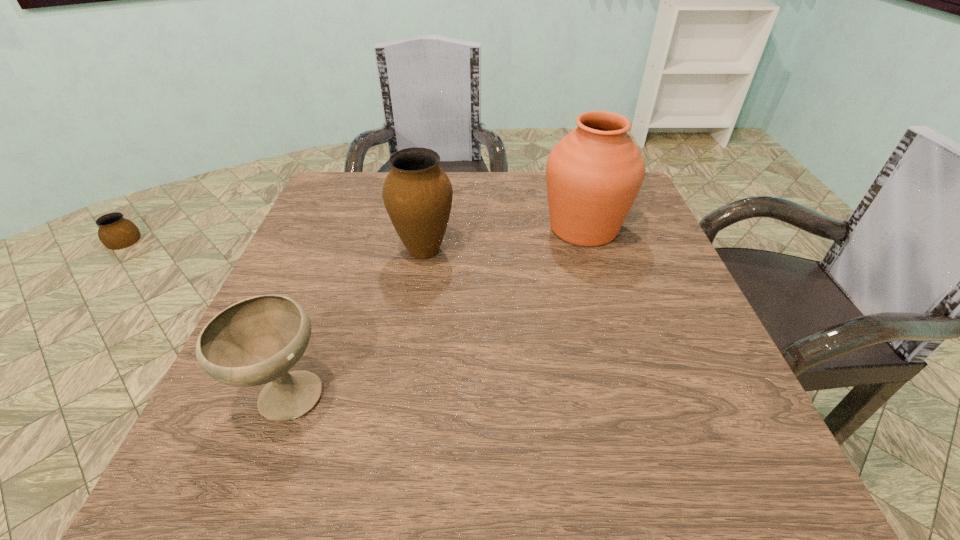
The height and width of the screenshot is (540, 960). I want to click on object that stands as the closest to the taller urn, so click(417, 194).

Identify the location of object that is the second closest to the second object from right to left. pyautogui.click(x=256, y=341).

I want to click on vacant region that satisfies the following two spatial constraints: 1. on the back side of the second tallest object; 2. on the left side of the taller urn, so [x=427, y=228].

This screenshot has width=960, height=540. Find the location of `vacant space that satisfies the following two spatial constraints: 1. on the back side of the nearest object; 2. on the left side of the tallest object`. vacant space that satisfies the following two spatial constraints: 1. on the back side of the nearest object; 2. on the left side of the tallest object is located at coordinates (348, 228).

Identify the location of free point that satisfies the following two spatial constraints: 1. on the back side of the left urn; 2. on the right side of the nearest object. Image resolution: width=960 pixels, height=540 pixels. (340, 251).

Locate an element on the screen. The height and width of the screenshot is (540, 960). free location that satisfies the following two spatial constraints: 1. on the back side of the second shortest object; 2. on the right side of the shortest object is located at coordinates (340, 251).